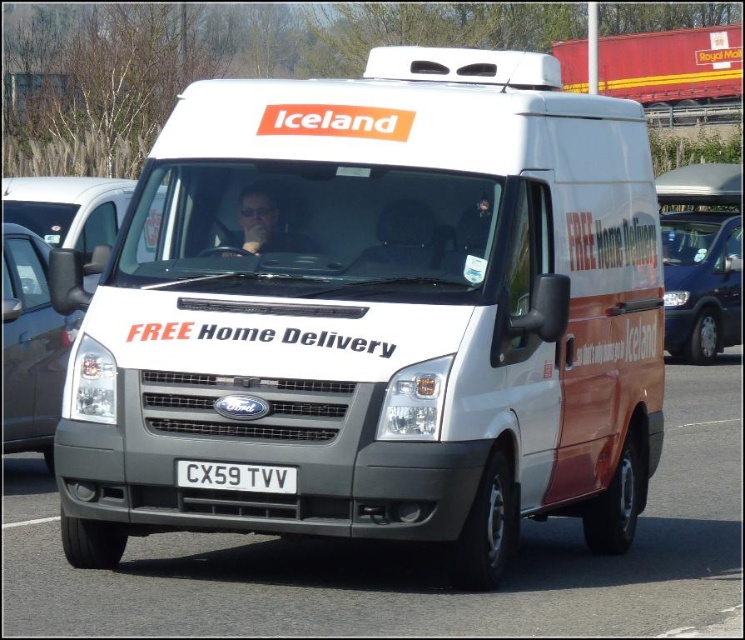
Question: Which object is farther from the camera taking this photo?

Choices:
 (A) white matte van at center
 (B) metallic blue van at right

Answer: (B)

Question: Which point is closer to the camera?

Choices:
 (A) metallic blue van at right
 (B) satin black van at left

Answer: (B)

Question: Does satin black van at left have a greater width compared to white plastic license plate at center?

Choices:
 (A) yes
 (B) no

Answer: (B)

Question: Which is nearer to the white plastic license plate at center?

Choices:
 (A) metallic blue van at right
 (B) satin black van at left
 (C) white matte van at center

Answer: (C)

Question: Does white matte van at center have a larger size compared to satin black van at left?

Choices:
 (A) yes
 (B) no

Answer: (A)

Question: Can you confirm if satin black van at left is positioned to the left of metallic blue van at right?

Choices:
 (A) no
 (B) yes

Answer: (B)